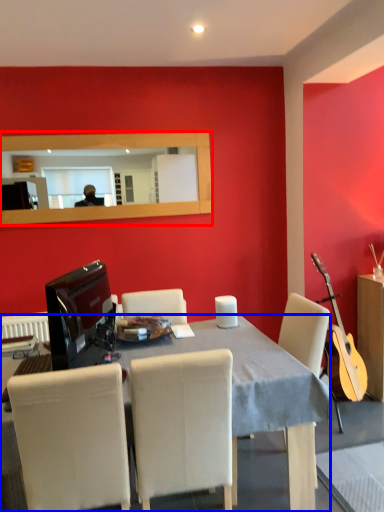
Question: Which object is further to the camera taking this photo, mirror (highlighted by a red box) or desk (highlighted by a blue box)?

Choices:
 (A) mirror
 (B) desk

Answer: (A)